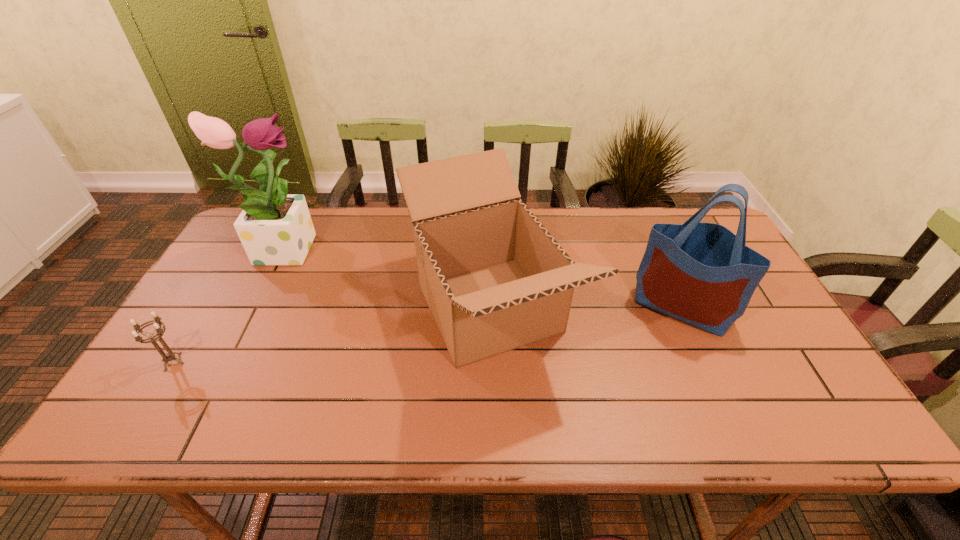
Locate an element on the screen. The height and width of the screenshot is (540, 960). object that is positioned at the near edge is located at coordinates (494, 278).

Locate an element on the screen. The image size is (960, 540). flower arrangement positioned at the left edge is located at coordinates (274, 228).

This screenshot has width=960, height=540. Find the location of `candle holder that is at the left edge`. candle holder that is at the left edge is located at coordinates (169, 356).

This screenshot has width=960, height=540. I want to click on object present at the right edge, so click(703, 274).

The image size is (960, 540). I want to click on object at the far left corner, so click(x=274, y=228).

The height and width of the screenshot is (540, 960). I want to click on vacant space at the far edge of the desktop, so click(326, 215).

The width and height of the screenshot is (960, 540). What are the coordinates of `vacant space at the near edge` in the screenshot? It's located at (439, 411).

In the image, there is a desktop. At what (x,y) coordinates should I click in order to perform the action: click on vacant region at the left edge. Please return your answer as a coordinate pair (x, y). Looking at the image, I should click on (201, 397).

This screenshot has height=540, width=960. What are the coordinates of `vacant space at the right edge of the desktop` in the screenshot? It's located at (780, 347).

Locate an element on the screen. The image size is (960, 540). free point between the flower arrangement and the shortest object is located at coordinates point(228,304).